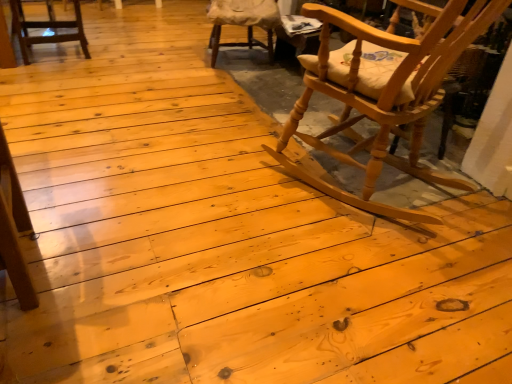
This screenshot has width=512, height=384. Find the location of `vacant area that is situated to the right of matte wood chair at upper left, which is the 3th chair in right-to-left order`. vacant area that is situated to the right of matte wood chair at upper left, which is the 3th chair in right-to-left order is located at coordinates (118, 59).